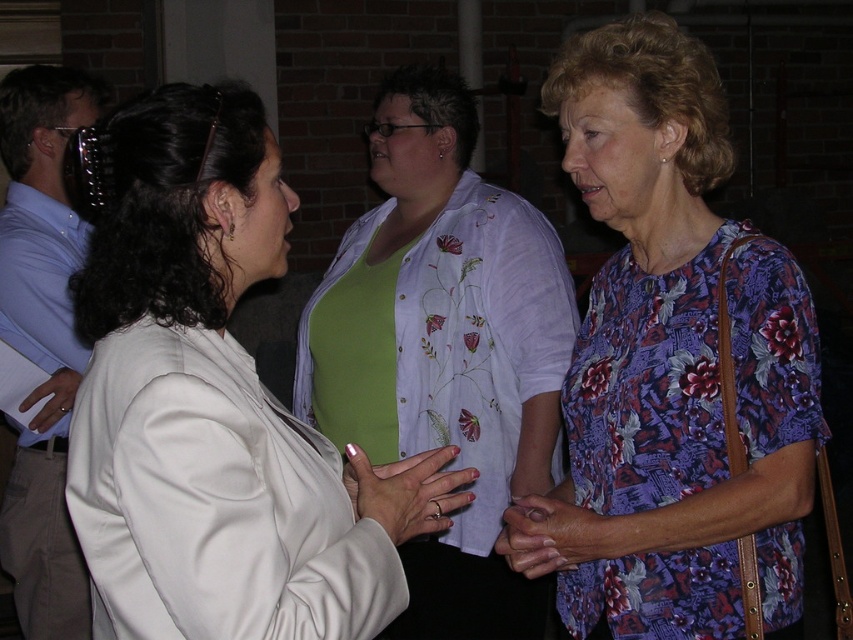
Question: Which point appears closest to the camera in this image?

Choices:
 (A) (402, 460)
 (B) (695, 68)
 (C) (422, 204)

Answer: (A)

Question: Estimate the real-world distances between objects in this image. Which object is farther from the floral print blouse at center?

Choices:
 (A) light blue shirt at left
 (B) matte white hand at center
 (C) matte white blazer at left

Answer: (A)

Question: Is green embroidered blouse at center bigger than floral fabric hand at center?

Choices:
 (A) yes
 (B) no

Answer: (A)

Question: Which point is farther from the camera taking this photo?

Choices:
 (A) (665, 168)
 (B) (567, 496)
 (C) (258, 438)
 (D) (440, 502)

Answer: (B)

Question: Does green embroidered blouse at center appear under light blue shirt at left?

Choices:
 (A) no
 (B) yes

Answer: (B)

Question: Does matte white hand at center appear on the left side of floral fabric hand at center?

Choices:
 (A) no
 (B) yes

Answer: (B)